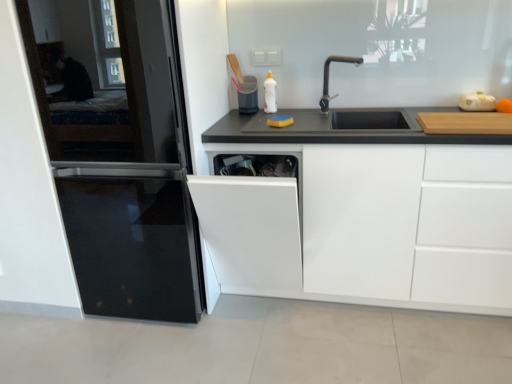
Question: Can you confirm if black metallic faucet at upper center is bigger than black glass refrigerator at left?

Choices:
 (A) yes
 (B) no

Answer: (B)

Question: Is black metallic faucet at upper center not near black glass refrigerator at left?

Choices:
 (A) yes
 (B) no

Answer: (A)

Question: From a real-world perspective, is black metallic faucet at upper center under black glass refrigerator at left?

Choices:
 (A) no
 (B) yes

Answer: (A)

Question: Does black metallic faucet at upper center have a lesser width compared to black glass refrigerator at left?

Choices:
 (A) no
 (B) yes

Answer: (B)

Question: Is black metallic faucet at upper center positioned behind black glass refrigerator at left?

Choices:
 (A) no
 (B) yes

Answer: (B)

Question: From a real-world perspective, is black metallic faucet at upper center positioned over black glass refrigerator at left based on gravity?

Choices:
 (A) yes
 (B) no

Answer: (A)

Question: Is matte plastic trash can at center, the 1th appliance positioned from the back, smaller than white plastic cutting board at upper right, the second appliance in the left-to-right sequence?

Choices:
 (A) no
 (B) yes

Answer: (A)

Question: From a real-world perspective, is matte plastic trash can at center, which is the 2th appliance from right to left, below white plastic cutting board at upper right, which is counted as the second appliance, starting from the back?

Choices:
 (A) yes
 (B) no

Answer: (B)

Question: Does matte plastic trash can at center, the 1th appliance positioned from the back, appear on the right side of white plastic cutting board at upper right, which is counted as the second appliance, starting from the back?

Choices:
 (A) no
 (B) yes

Answer: (A)

Question: Is matte plastic trash can at center, the second appliance from the front, not close to white plastic cutting board at upper right, which is the 1th appliance from front to back?

Choices:
 (A) no
 (B) yes

Answer: (B)

Question: Does matte plastic trash can at center, which is the 1th appliance in left-to-right order, have a greater height compared to white plastic cutting board at upper right, the second appliance in the left-to-right sequence?

Choices:
 (A) no
 (B) yes

Answer: (B)

Question: Considering the relative sizes of matte plastic trash can at center, which is the 1th appliance in left-to-right order, and white plastic cutting board at upper right, which is the 1th appliance from front to back, in the image provided, is matte plastic trash can at center, which is the 1th appliance in left-to-right order, thinner than white plastic cutting board at upper right, which is the 1th appliance from front to back,?

Choices:
 (A) no
 (B) yes

Answer: (A)

Question: Is white plastic cutting board at upper right, marked as the first appliance in a right-to-left arrangement, smaller than white glossy bottle at upper center?

Choices:
 (A) yes
 (B) no

Answer: (A)